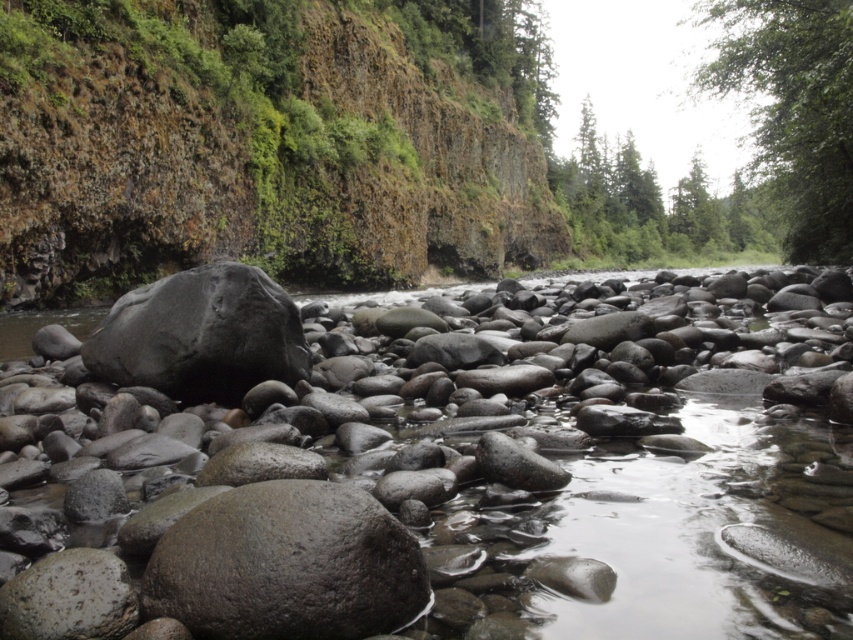
You are standing at the edge of the river and see two points marked on the rocks. The first point is at coordinates point [767,161] and the second is at point [647,189]. Which point is closer to you?

Point [767,161] is in front of point [647,189], so the first point is closer to you.

You are standing at the center of the riverbed and want to reach the green mossy rock at left. In which direction should you move to get there?

You should move to the left to reach the green mossy rock at left since it is located at the left side of the scene.

You are standing at the center of the rocky riverbed and want to reach the green leafy tree at upper right. Which direction should you move relative to the green mossy rock at left?

To reach the green leafy tree at upper right, you should move towards the upper right direction away from the green mossy rock at left, since the green mossy rock at left is located below the green leafy tree at upper right.